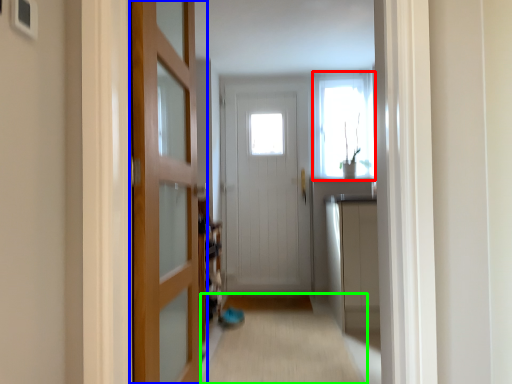
Question: Which object is the farthest from window (highlighted by a red box)? Choose among these: door (highlighted by a blue box) or alley (highlighted by a green box).

Choices:
 (A) door
 (B) alley

Answer: (A)